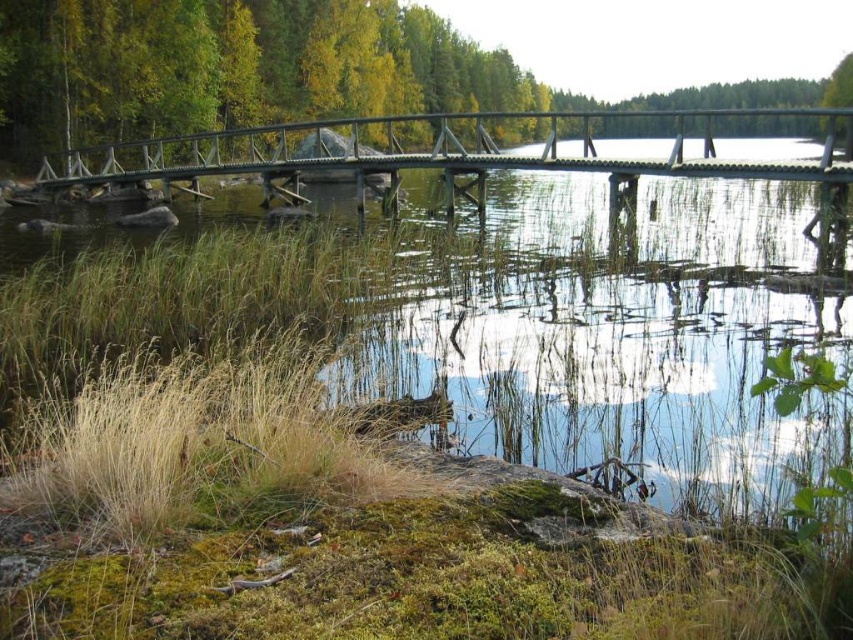
Consider the image. Does green matte tree at upper center have a greater height compared to wooden bridge at center?

Yes, green matte tree at upper center is taller than wooden bridge at center.

Does green matte tree at upper center have a greater width compared to wooden bridge at center?

Yes.

Does point (782, 106) lie in front of point (450, 195)?

No, (782, 106) is further to viewer.

Where is `green matte tree at upper center`? The width and height of the screenshot is (853, 640). green matte tree at upper center is located at coordinates (233, 67).